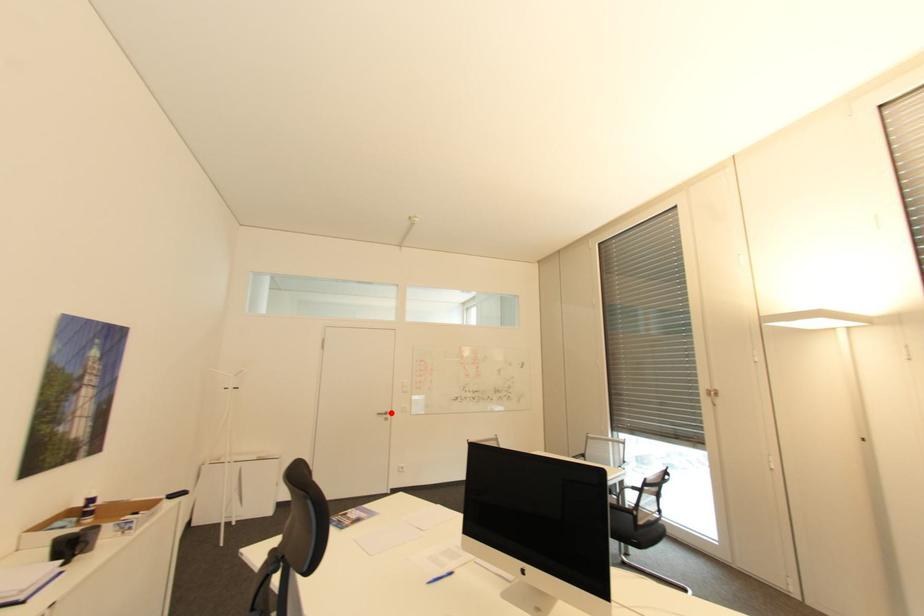
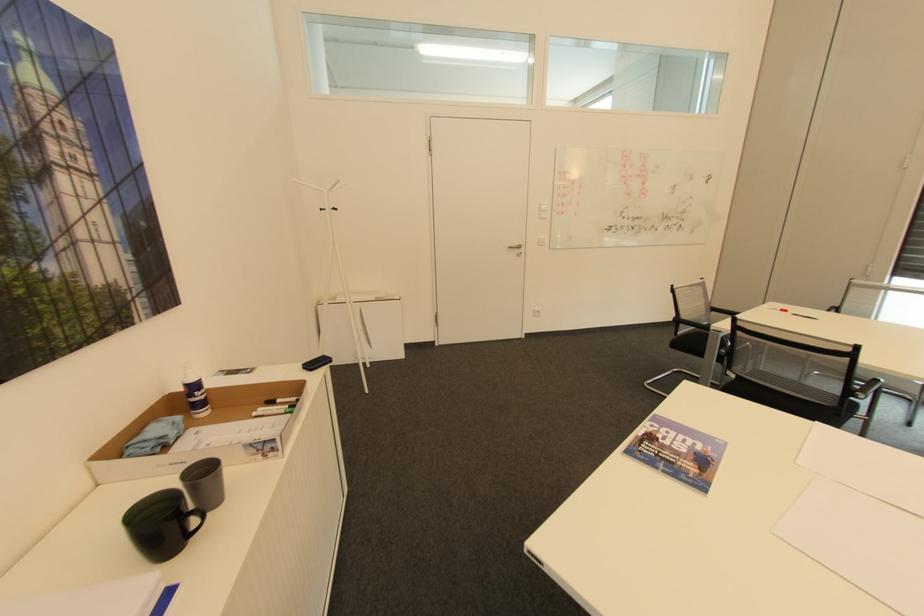
Question: I am providing you with two images of the same scene from different viewpoints. A red point is marked on the first image. Is the red point's position out of view in image 2?

Choices:
 (A) Yes
 (B) No

Answer: (B)